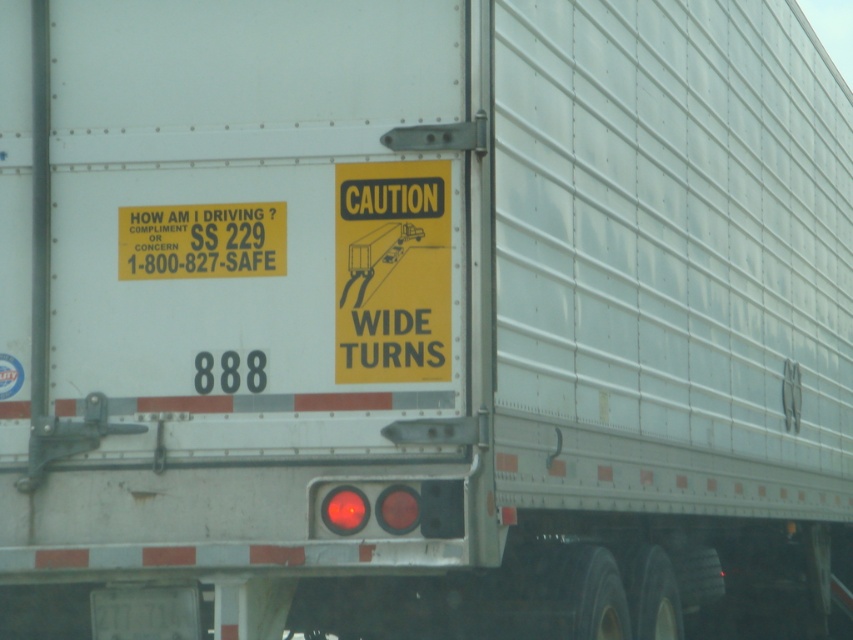
Is yellow paper caution sign at center smaller than white matte license plate at lower center?

No, yellow paper caution sign at center is not smaller than white matte license plate at lower center.

Between yellow paper caution sign at center and white matte license plate at lower center, which one is positioned lower?

white matte license plate at lower center is below.

Between point (392, 349) and point (113, 618), which one is positioned in front?

Point (392, 349) is more forward.

The width and height of the screenshot is (853, 640). I want to click on yellow paper caution sign at center, so click(392, 272).

You are a GUI agent. You are given a task and a screenshot of the screen. Output one action in this format:
    pyautogui.click(x=<x>, y=<y>)
    Task: Click on the yellow paper caution sign at center
    The width and height of the screenshot is (853, 640).
    Given the screenshot: What is the action you would take?
    pyautogui.click(x=392, y=272)

Who is more forward, (347, 195) or (234, 252)?

Point (347, 195) is more forward.

At what (x,y) coordinates should I click in order to perform the action: click on yellow paper caution sign at center. Please return your answer as a coordinate pair (x, y). Looking at the image, I should click on (392, 272).

Image resolution: width=853 pixels, height=640 pixels. I want to click on yellow paper caution sign at center, so click(392, 272).

Which is in front, point (136, 260) or point (105, 593)?

Point (136, 260) is more forward.

How much distance is there between yellow paper sign at left and white matte license plate at lower center?

They are 88.84 centimeters apart.

Measure the distance between yellow paper sign at left and camera.

yellow paper sign at left is 5.16 meters from camera.

Where is `yellow paper sign at left`? This screenshot has height=640, width=853. yellow paper sign at left is located at coordinates (202, 241).